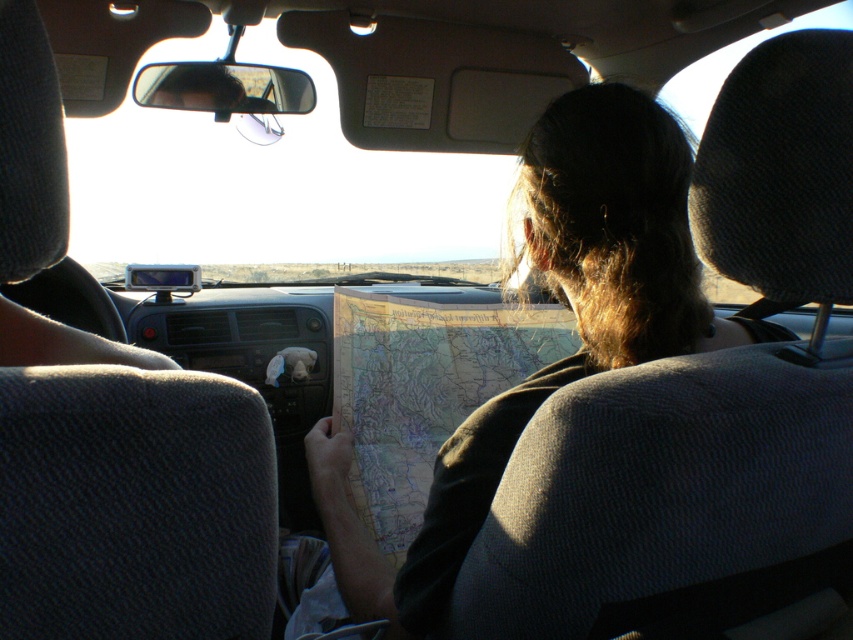
Does brown paper map at center lie behind yellowed paper map at center?

That is False.

Who is lower down, brown paper map at center or yellowed paper map at center?

Positioned lower is brown paper map at center.

Where is `brown paper map at center`? The width and height of the screenshot is (853, 640). brown paper map at center is located at coordinates (577, 326).